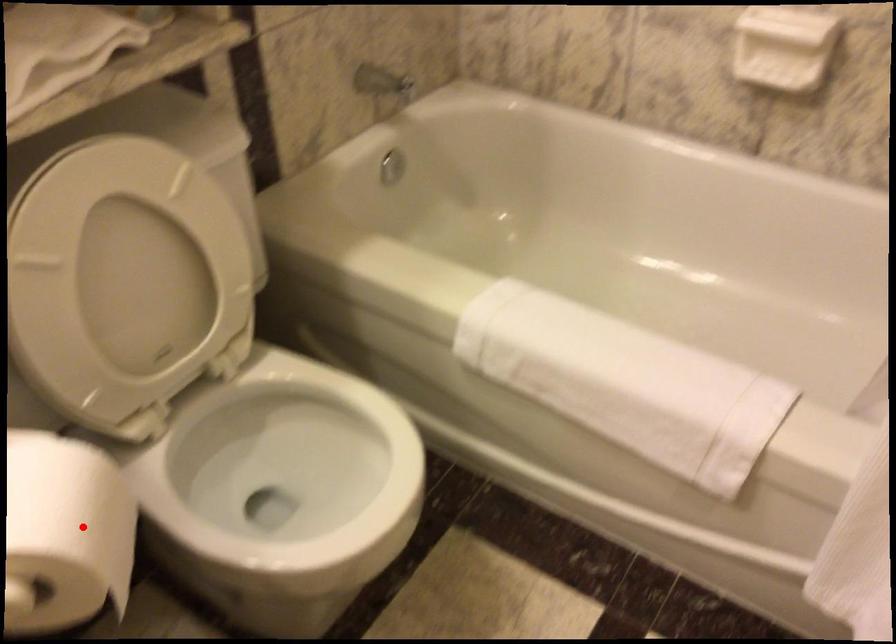
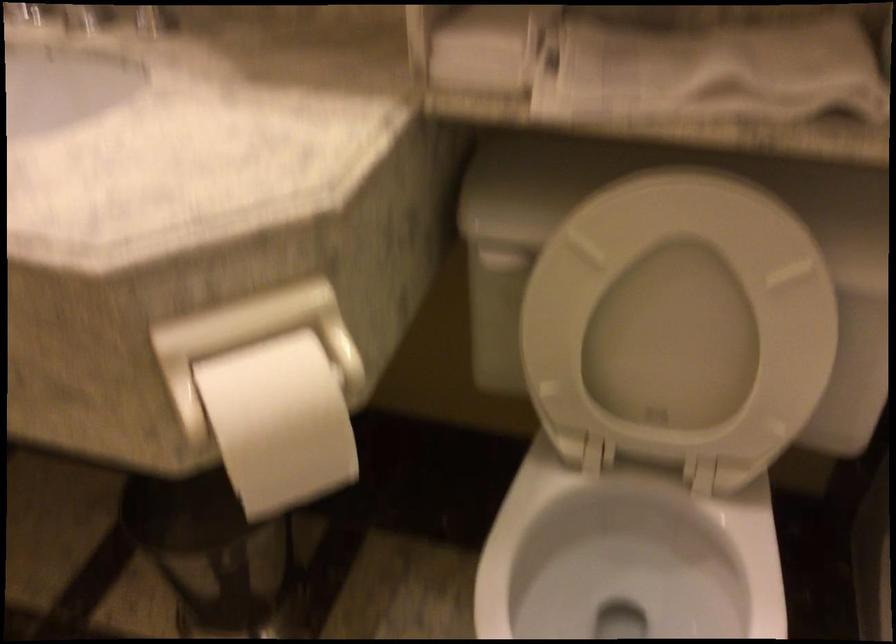
Question: I am providing you with two images of the same scene from different viewpoints. A red point is marked on the first image. Is the red point's position out of view in image 2?

Choices:
 (A) Yes
 (B) No

Answer: (B)